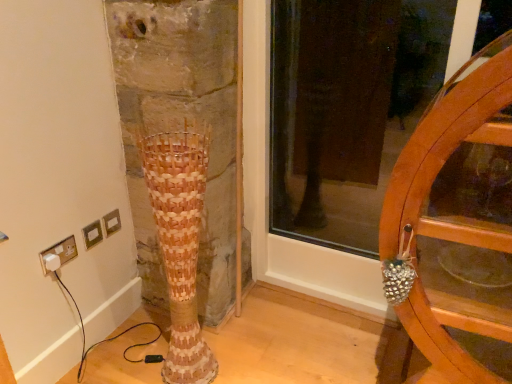
Question: Is woven wood vase at center in front of white plastic plug at lower left?

Choices:
 (A) no
 (B) yes

Answer: (B)

Question: Considering the relative sizes of woven wood vase at center and white plastic plug at lower left in the image provided, is woven wood vase at center smaller than white plastic plug at lower left?

Choices:
 (A) no
 (B) yes

Answer: (A)

Question: From the image's perspective, would you say woven wood vase at center is positioned over white plastic plug at lower left?

Choices:
 (A) yes
 (B) no

Answer: (B)

Question: Is woven wood vase at center positioned behind white plastic plug at lower left?

Choices:
 (A) no
 (B) yes

Answer: (A)

Question: From the image's perspective, is woven wood vase at center below white plastic plug at lower left?

Choices:
 (A) yes
 (B) no

Answer: (A)

Question: Is woven wood vase at center thinner than white plastic plug at lower left?

Choices:
 (A) no
 (B) yes

Answer: (A)

Question: Does white plastic plug at lower left contain wooden wheel at right?

Choices:
 (A) yes
 (B) no

Answer: (B)

Question: Is white plastic plug at lower left at the left side of wooden wheel at right?

Choices:
 (A) yes
 (B) no

Answer: (A)

Question: From a real-world perspective, is white plastic plug at lower left below wooden wheel at right?

Choices:
 (A) yes
 (B) no

Answer: (A)

Question: Is white plastic plug at lower left turned away from wooden wheel at right?

Choices:
 (A) no
 (B) yes

Answer: (A)

Question: Considering the relative sizes of white plastic plug at lower left and wooden wheel at right in the image provided, is white plastic plug at lower left thinner than wooden wheel at right?

Choices:
 (A) no
 (B) yes

Answer: (B)

Question: Considering the relative sizes of white plastic plug at lower left and wooden wheel at right in the image provided, is white plastic plug at lower left smaller than wooden wheel at right?

Choices:
 (A) yes
 (B) no

Answer: (A)

Question: From a real-world perspective, is white plastic plug at lower left under woven wood vase at center?

Choices:
 (A) yes
 (B) no

Answer: (A)